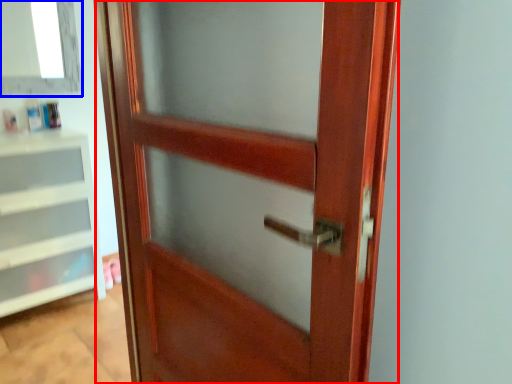
Question: Which object is further to the camera taking this photo, door (highlighted by a red box) or window (highlighted by a blue box)?

Choices:
 (A) door
 (B) window

Answer: (B)